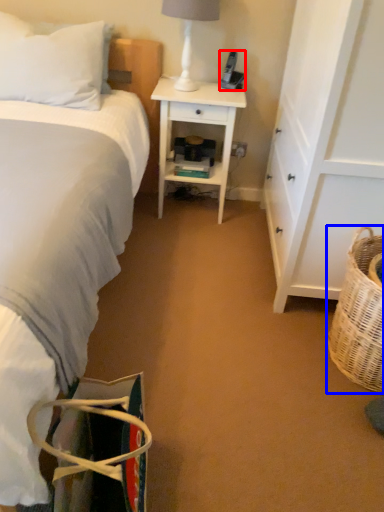
Question: Which object is closer to the camera taking this photo, corded phone (highlighted by a red box) or picnic basket (highlighted by a blue box)?

Choices:
 (A) corded phone
 (B) picnic basket

Answer: (B)